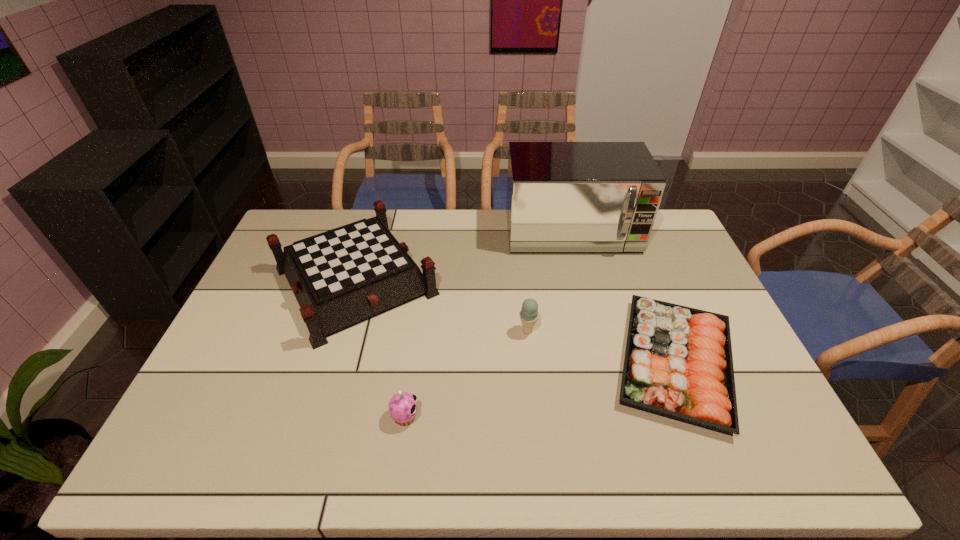
At what (x,y) coordinates should I click in order to perform the action: click on microwave oven located at the far edge. Please return your answer as a coordinate pair (x, y). Looking at the image, I should click on (561, 196).

Locate an element on the screen. The width and height of the screenshot is (960, 540). checkerboard present at the far edge is located at coordinates (339, 277).

Where is `object that is at the near edge`? object that is at the near edge is located at coordinates (678, 364).

You are a GUI agent. You are given a task and a screenshot of the screen. Output one action in this format:
    pyautogui.click(x=<x>, y=<y>)
    Task: Click on the object that is at the left edge
    The image size is (960, 540).
    Given the screenshot: What is the action you would take?
    pyautogui.click(x=339, y=277)

Where is `microwave oven that is at the right edge`? The height and width of the screenshot is (540, 960). microwave oven that is at the right edge is located at coordinates (561, 196).

Image resolution: width=960 pixels, height=540 pixels. In order to click on platter that is at the right edge in this screenshot , I will do (678, 364).

Locate an element on the screen. object that is at the far left corner is located at coordinates (339, 277).

Image resolution: width=960 pixels, height=540 pixels. I want to click on object at the far right corner, so click(x=561, y=196).

This screenshot has height=540, width=960. In order to click on object present at the near right corner in this screenshot , I will do `click(678, 364)`.

Locate an element on the screen. The height and width of the screenshot is (540, 960). free space at the far edge of the desktop is located at coordinates 487,231.